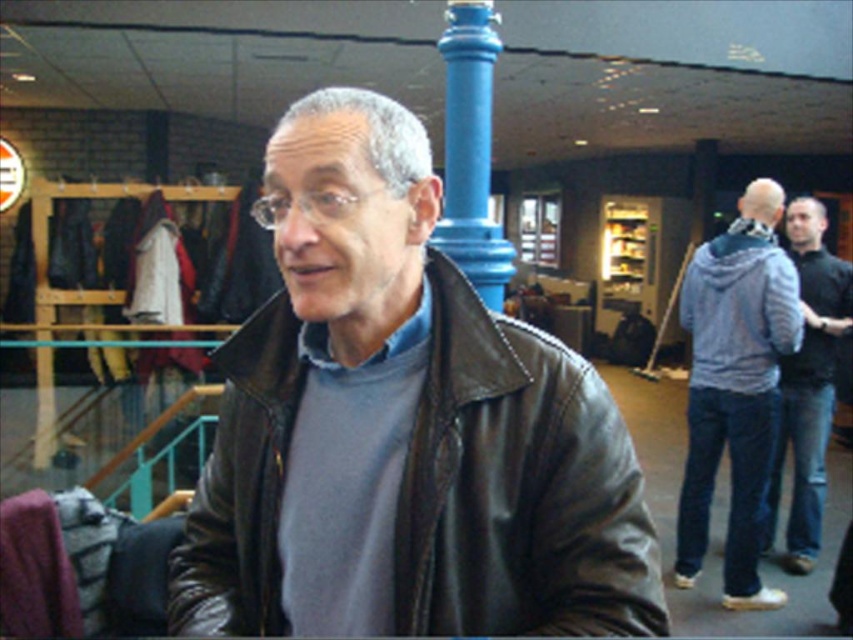
Which is in front, point (772, 304) or point (795, 570)?

Positioned in front is point (772, 304).

Does light blue hoodie at right have a larger size compared to dark blue jeans at right?

Actually, light blue hoodie at right might be smaller than dark blue jeans at right.

Does point (735, 291) lie behind point (838, 284)?

No, it is not.

This screenshot has height=640, width=853. I want to click on light blue hoodie at right, so click(x=735, y=387).

Is black leather jacket at center to the left of light blue hoodie at right from the viewer's perspective?

Correct, you'll find black leather jacket at center to the left of light blue hoodie at right.

Where is `black leather jacket at center`? The height and width of the screenshot is (640, 853). black leather jacket at center is located at coordinates (517, 486).

Is black leather jacket at center above dark blue jeans at right?

Indeed, black leather jacket at center is positioned over dark blue jeans at right.

Is black leather jacket at center bigger than dark blue jeans at right?

No.

Between point (432, 573) and point (809, 513), which one is positioned in front?

Point (432, 573) is more forward.

The height and width of the screenshot is (640, 853). In order to click on black leather jacket at center in this screenshot , I will do `click(517, 486)`.